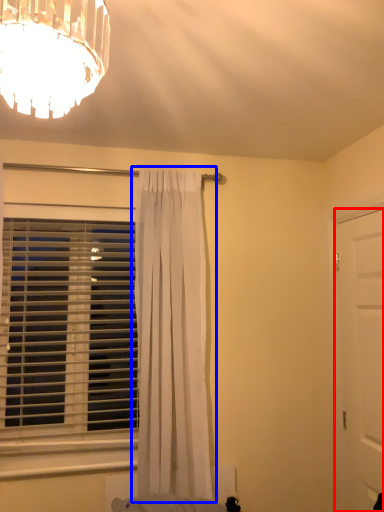
Question: Which point is closer to the camera, door (highlighted by a red box) or curtain (highlighted by a blue box)?

Choices:
 (A) door
 (B) curtain

Answer: (A)